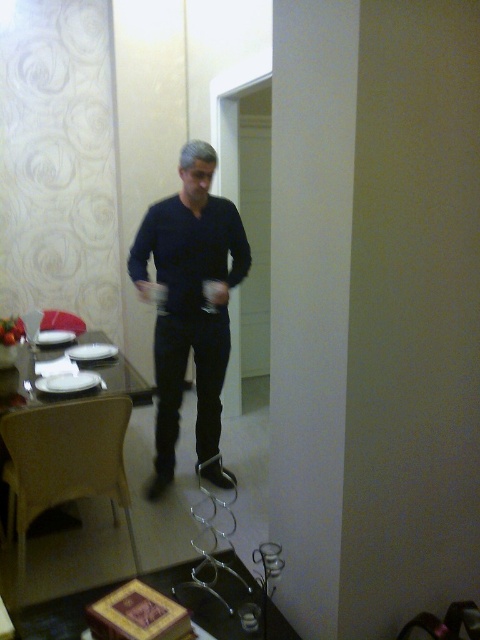
You are standing in the dining area and want to locate the dark blue shirt at center. According to the coordinates provided, where would you look to find it?

Answer: The dark blue shirt at center is located at point coordinates of (190, 301).

You are a photographer setting up a shot in the dining area. You need to ensure that the dark blue shirt at center and the white glossy table at left are both in focus. Given their sizes, which object should you prioritize adjusting the camera focus for to ensure both are clear?

The dark blue shirt at center has a larger size compared to the white glossy table at left, so you should prioritize adjusting the camera focus for the dark blue shirt at center to ensure both are clear.

From the picture: You are a guest entering the dining room and see the dark blue shirt at center and the white glossy table at left. Which object is closer to the entrance?

The white glossy table at left is closer to the entrance because the dark blue shirt at center is to the right of it, implying the table is nearer the entrance.